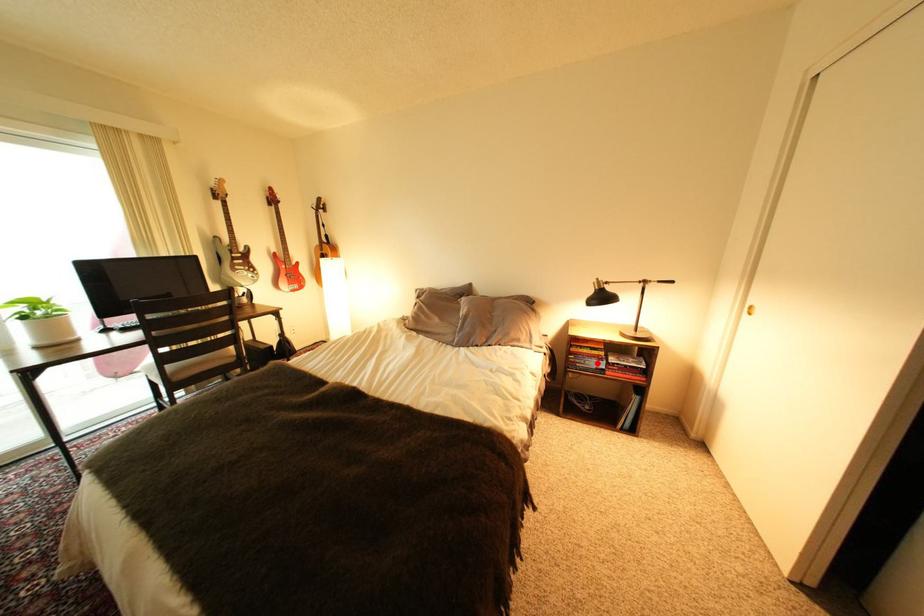
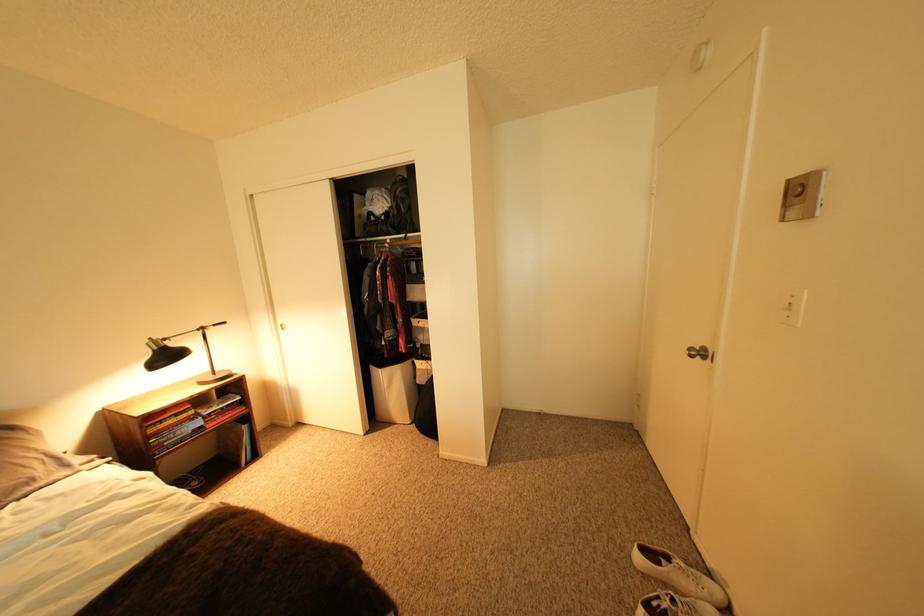
The point at the highlighted location is marked in the first image. Where is the corresponding point in the second image?

(188, 435)